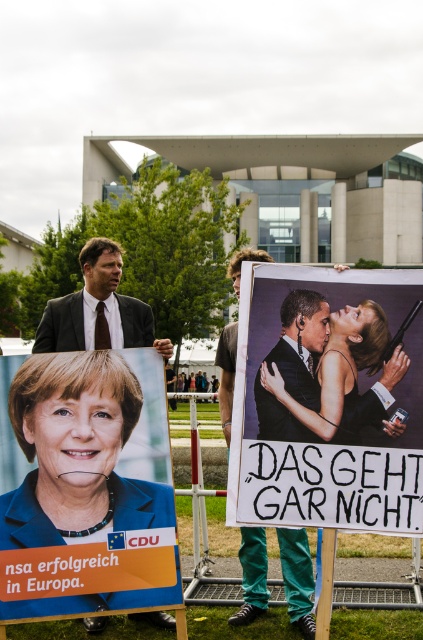
Does matte black poster at center come in front of dark brown suit at center?

Yes, matte black poster at center is closer to the viewer.

Is matte black poster at center to the left of dark brown suit at center from the viewer's perspective?

No, matte black poster at center is not to the left of dark brown suit at center.

Is point (326, 342) positioned before point (128, 342)?

Yes, point (326, 342) is closer to viewer.

You are a GUI agent. You are given a task and a screenshot of the screen. Output one action in this format:
    pyautogui.click(x=<x>, y=<y>)
    Task: Click on the matte black poster at center
    
    Given the screenshot: What is the action you would take?
    pyautogui.click(x=327, y=403)

Is matte orange poster at lower left shorter than smooth skin woman at center?

In fact, matte orange poster at lower left may be taller than smooth skin woman at center.

Which is in front, point (57, 401) or point (357, 317)?

Point (357, 317)

Which is in front, point (164, 493) or point (351, 406)?

Point (351, 406) is in front.

Image resolution: width=423 pixels, height=640 pixels. In order to click on matte orange poster at lower left in this screenshot , I will do `click(77, 454)`.

Between matte orange poster at lower left and matte black suit at center, which one is positioned lower?

Positioned lower is matte black suit at center.

Does matte orange poster at lower left appear on the right side of matte black suit at center?

Incorrect, matte orange poster at lower left is not on the right side of matte black suit at center.

Which is in front, point (24, 611) or point (290, 305)?

Positioned in front is point (290, 305).

Where is `matte orange poster at lower left`? matte orange poster at lower left is located at coordinates (77, 454).